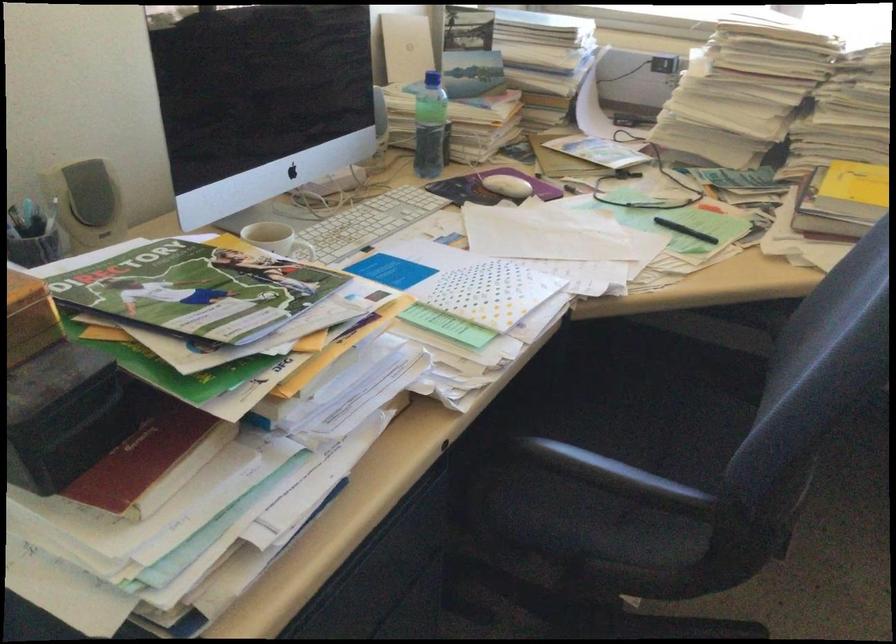
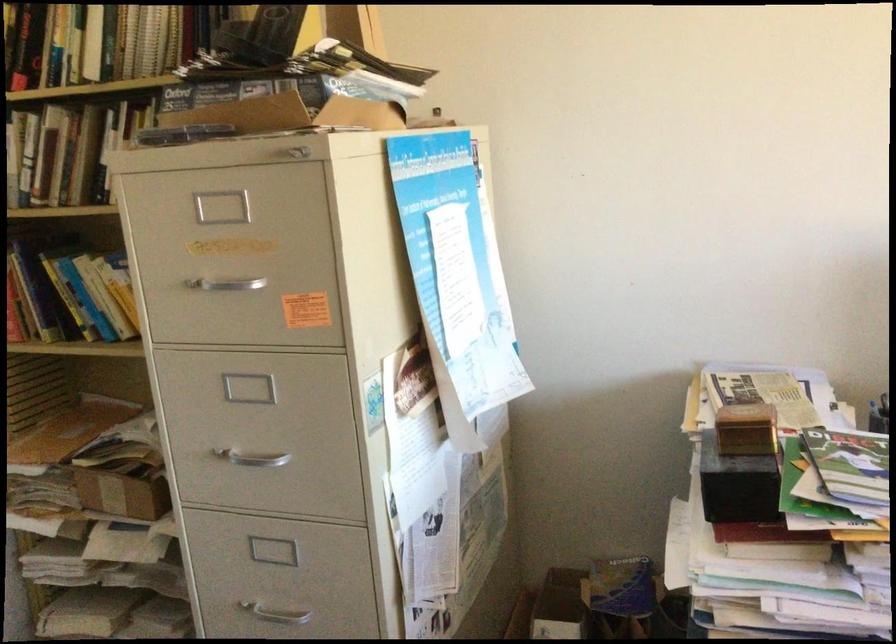
Question: Based on the continuous images, in which direction is the camera rotating? Reply with the corresponding letter.

Choices:
 (A) Left
 (B) Right
 (C) Up
 (D) Down

Answer: (A)